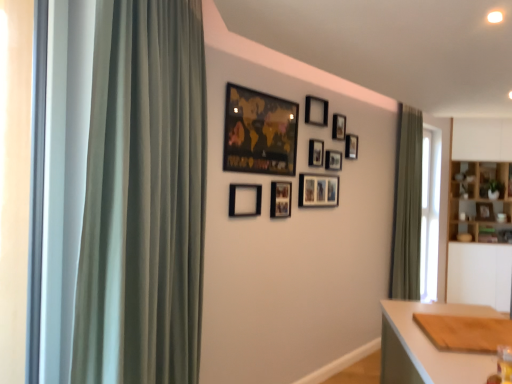
Question: Which direction should I rotate to look at black matte picture frame at upper center, which is the fifth picture frame in left-to-right order?

Choices:
 (A) left
 (B) right

Answer: (B)

Question: Is black matte picture frame at upper center, which ranks as the sixth picture frame in right-to-left order, beside wooden cabinet at right?

Choices:
 (A) no
 (B) yes

Answer: (A)

Question: Is black matte picture frame at upper center, which ranks as the sixth picture frame in right-to-left order, facing away from wooden cabinet at right?

Choices:
 (A) no
 (B) yes

Answer: (A)

Question: Does black matte picture frame at upper center, which ranks as the sixth picture frame in right-to-left order, lie in front of wooden cabinet at right?

Choices:
 (A) no
 (B) yes

Answer: (B)

Question: From the image's perspective, is black matte picture frame at upper center, which is the fifth picture frame in left-to-right order, over wooden cabinet at right?

Choices:
 (A) yes
 (B) no

Answer: (A)

Question: Is wooden cabinet at right located within black matte picture frame at upper center, marked as the fifth picture frame in a front-to-back arrangement?

Choices:
 (A) no
 (B) yes

Answer: (A)

Question: From the image's perspective, is black matte picture frame at upper center, which ranks as the sixth picture frame in right-to-left order, located beneath wooden cabinet at right?

Choices:
 (A) no
 (B) yes

Answer: (A)

Question: Can you confirm if black matte picture frame at upper center, marked as the sixth picture frame in a back-to-front arrangement, is smaller than wooden cutting board at lower right?

Choices:
 (A) no
 (B) yes

Answer: (B)

Question: From the image's perspective, is black matte picture frame at upper center, which ranks as the sixth picture frame in right-to-left order, under wooden cutting board at lower right?

Choices:
 (A) no
 (B) yes

Answer: (A)

Question: Is black matte picture frame at upper center, which is the fifth picture frame in left-to-right order, behind wooden cutting board at lower right?

Choices:
 (A) no
 (B) yes

Answer: (B)

Question: Is black matte picture frame at upper center, which ranks as the sixth picture frame in right-to-left order, far from wooden cutting board at lower right?

Choices:
 (A) no
 (B) yes

Answer: (B)

Question: Considering the relative sizes of black matte picture frame at upper center, which is the fifth picture frame in left-to-right order, and wooden cutting board at lower right in the image provided, is black matte picture frame at upper center, which is the fifth picture frame in left-to-right order, taller than wooden cutting board at lower right?

Choices:
 (A) yes
 (B) no

Answer: (B)

Question: From the image's perspective, would you say black matte picture frame at upper center, which is the fifth picture frame in left-to-right order, is positioned over wooden cutting board at lower right?

Choices:
 (A) no
 (B) yes

Answer: (B)

Question: Does matte black picture frame at upper center, which appears as the tenth picture frame when viewed from the back, lie behind black matte picture frame at upper center, which ranks as the 9th picture frame in left-to-right order?

Choices:
 (A) no
 (B) yes

Answer: (A)